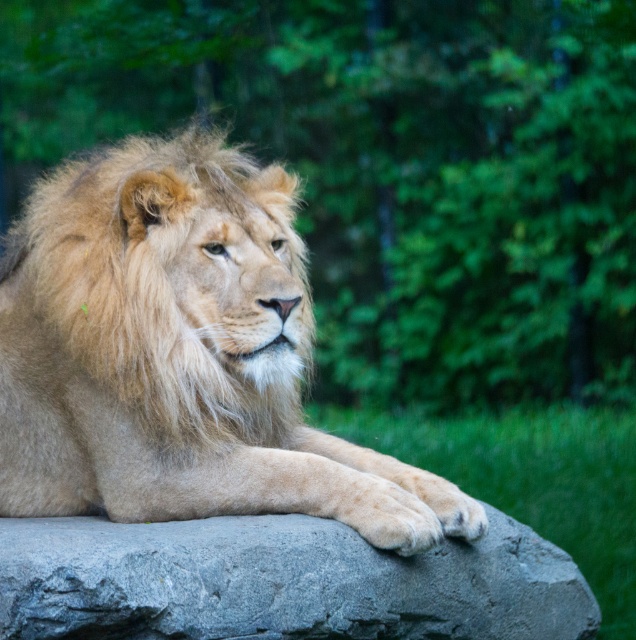
Describe the element at coordinates (389, 168) in the screenshot. The height and width of the screenshot is (640, 636). I see `green leafy tree at upper center` at that location.

Is green leafy tree at upper center positioned behind gray rough stone at center?

That is True.

Does point (438, 1) come farther from viewer compared to point (80, 630)?

Yes, it is behind point (80, 630).

Image resolution: width=636 pixels, height=640 pixels. What are the coordinates of `green leafy tree at upper center` in the screenshot? It's located at (389, 168).

Between green leafy tree at upper center and fuzzy golden mane at center, which one has more height?

Standing taller between the two is green leafy tree at upper center.

Can you confirm if green leafy tree at upper center is positioned to the left of fuzzy golden mane at center?

No, green leafy tree at upper center is not to the left of fuzzy golden mane at center.

Who is more forward, (408,177) or (52,288)?

Point (52,288)

This screenshot has height=640, width=636. Find the location of `green leafy tree at upper center`. green leafy tree at upper center is located at coordinates (389, 168).

Between green leafy tree at upper center and golden fur lion at center, which one is positioned lower?

Positioned lower is golden fur lion at center.

Who is more distant from viewer, (431, 333) or (92, 362)?

The point (431, 333) is more distant.

Locate an element on the screen. Image resolution: width=636 pixels, height=640 pixels. green leafy tree at upper center is located at coordinates (389, 168).